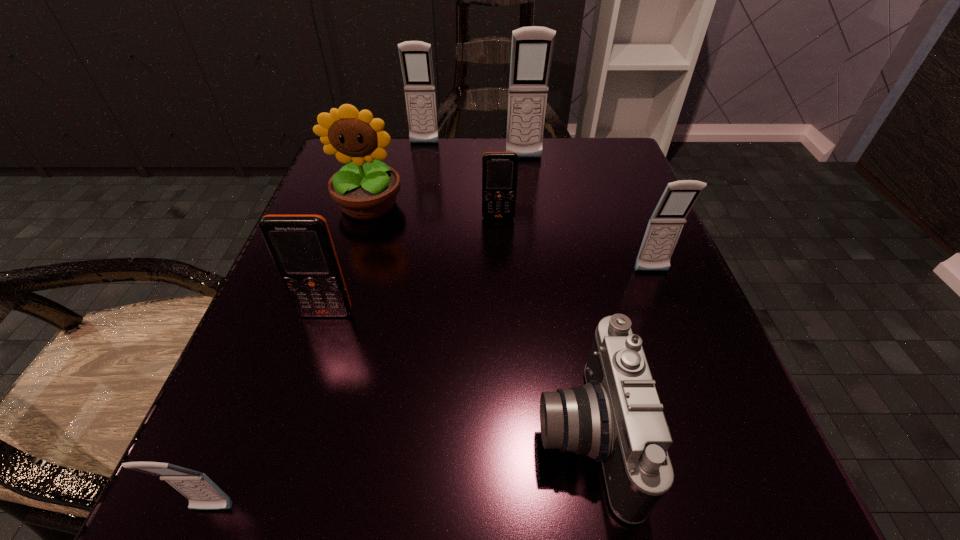
Identify the location of object located at the near left corner. (203, 494).

The height and width of the screenshot is (540, 960). I want to click on object at the near right corner, so click(x=616, y=418).

At what (x,y) coordinates should I click in order to perform the action: click on free space at the far edge. Please return your answer as a coordinate pair (x, y). The height and width of the screenshot is (540, 960). Looking at the image, I should click on (535, 161).

In the image, there is a desktop. At what (x,y) coordinates should I click in order to perform the action: click on vacant space at the near edge. Please return your answer as a coordinate pair (x, y). This screenshot has height=540, width=960. Looking at the image, I should click on (480, 500).

In the image, there is a desktop. Where is `vacant space at the left edge`? This screenshot has height=540, width=960. vacant space at the left edge is located at coordinates (310, 322).

The width and height of the screenshot is (960, 540). In the image, there is a desktop. What are the coordinates of `vacant area at the right edge` in the screenshot? It's located at (612, 213).

This screenshot has height=540, width=960. In order to click on vacant space at the far left corner of the desktop in this screenshot , I will do `click(396, 161)`.

The image size is (960, 540). In the image, there is a desktop. Find the location of `vacant space at the near left corner`. vacant space at the near left corner is located at coordinates (274, 460).

At what (x,y) coordinates should I click in order to perform the action: click on vacant space at the far right corner of the desktop. Please return your answer as a coordinate pair (x, y). Image resolution: width=960 pixels, height=540 pixels. Looking at the image, I should click on (636, 168).

The image size is (960, 540). I want to click on free space between the nearer orange cellular telephone and the camera, so click(455, 373).